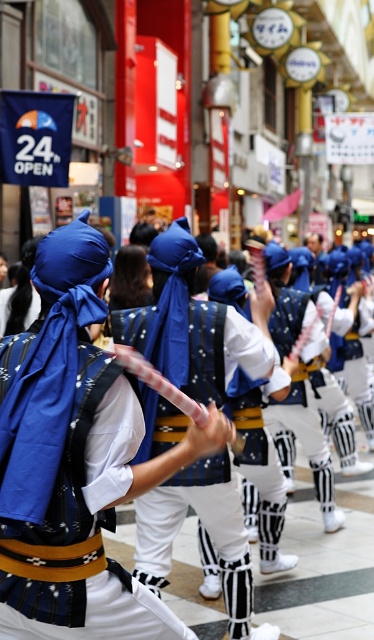
Question: Is matte blue headscarf at center thinner than white matte uniform at center?

Choices:
 (A) yes
 (B) no

Answer: (B)

Question: Which point is farther to the camera?

Choices:
 (A) (170, 413)
 (B) (304, 316)

Answer: (B)

Question: Which point appears farthest from the camera in this image?

Choices:
 (A) (221, 392)
 (B) (252, 632)

Answer: (B)

Question: In this image, where is matte blue headscarf at center located relative to white matte uniform at center?

Choices:
 (A) left
 (B) right

Answer: (A)

Question: Does matte blue headscarf at center have a greater width compared to blue fabric mask at center?

Choices:
 (A) yes
 (B) no

Answer: (B)

Question: Which point is closer to the camera?

Choices:
 (A) (75, 324)
 (B) (295, 381)

Answer: (A)